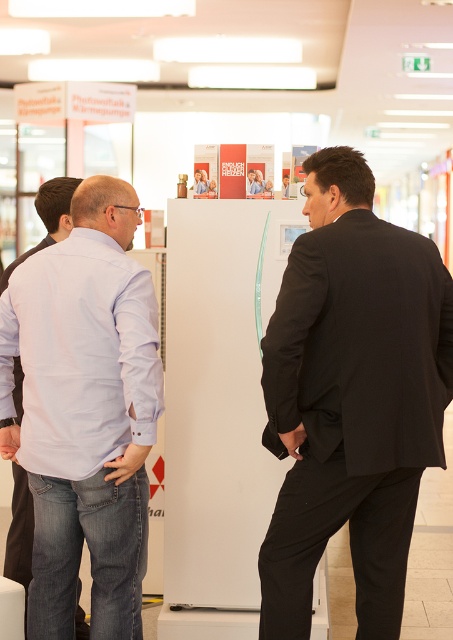
Question: Does black suit at center appear on the left side of light blue denim jeans at left?

Choices:
 (A) no
 (B) yes

Answer: (A)

Question: Which of the following is the closest to the observer?

Choices:
 (A) (356, 316)
 (B) (119, 401)

Answer: (A)

Question: Which object appears closest to the camera in this image?

Choices:
 (A) black suit at center
 (B) light blue denim jeans at left

Answer: (A)

Question: Does black suit at center lie in front of light blue denim jeans at left?

Choices:
 (A) no
 (B) yes

Answer: (B)

Question: In this image, where is black suit at center located relative to light blue denim jeans at left?

Choices:
 (A) left
 (B) right

Answer: (B)